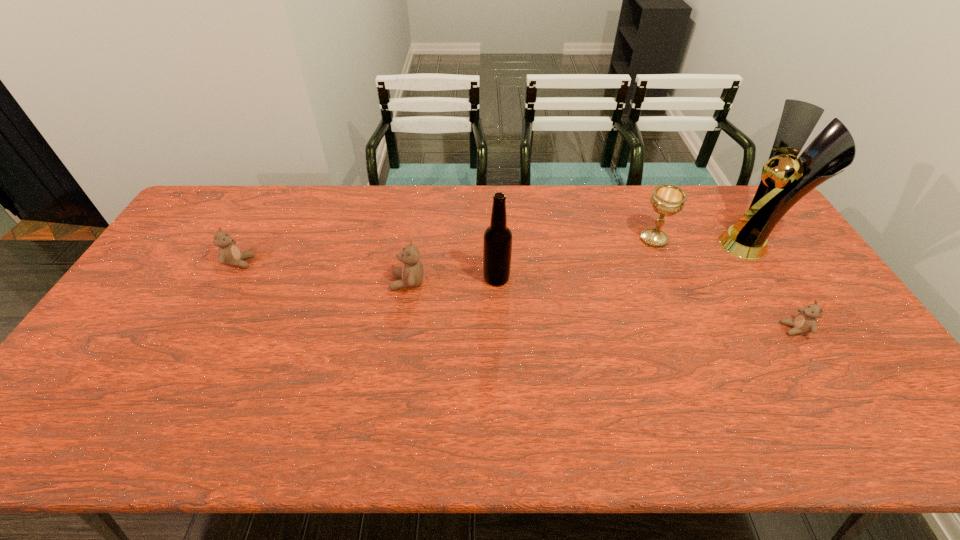
At what (x,y) coordinates should I click in order to perform the action: click on beer bottle. Please return your answer as a coordinate pair (x, y). Looking at the image, I should click on (497, 245).

The height and width of the screenshot is (540, 960). I want to click on vacant space located 0.310m on the front-facing side of the leftmost teddy bear, so click(353, 262).

I want to click on free space located 0.350m on the front-facing side of the third shortest object, so click(273, 282).

The width and height of the screenshot is (960, 540). I want to click on vacant position located on the front-facing side of the third shortest object, so click(x=327, y=282).

This screenshot has height=540, width=960. In order to click on free space located on the front-facing side of the third shortest object in this screenshot , I will do `click(270, 282)`.

Find the location of a particular element. vacant space located 0.310m on the front-facing side of the shortest teddy bear is located at coordinates (667, 329).

The width and height of the screenshot is (960, 540). In order to click on vacant area located 0.360m on the front-facing side of the shortest teddy bear in this screenshot , I will do `click(648, 329)`.

The width and height of the screenshot is (960, 540). In order to click on vacant space located 0.350m on the front-facing side of the shortest teddy bear in this screenshot , I will do `click(652, 329)`.

Find the location of a particular element. blank space located 0.350m on the left of the fourth shortest object is located at coordinates (531, 239).

At what (x,y) coordinates should I click in order to perform the action: click on vacant point located at the front of the award, where the globe is visible. Please return your answer as a coordinate pair (x, y). This screenshot has height=540, width=960. Looking at the image, I should click on (617, 244).